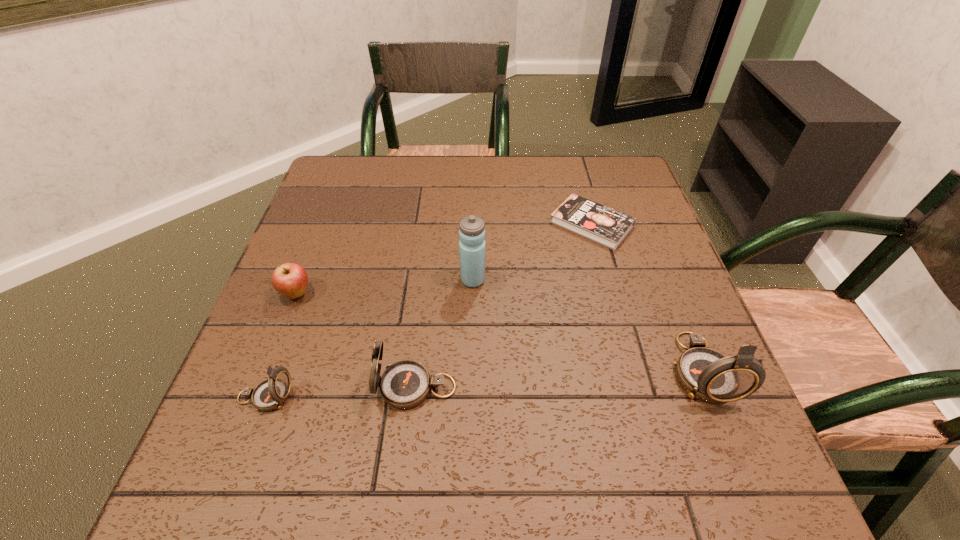
This screenshot has width=960, height=540. I want to click on object situated at the near left corner, so click(270, 394).

The height and width of the screenshot is (540, 960). What are the coordinates of `object at the far right corner` in the screenshot? It's located at (608, 227).

The width and height of the screenshot is (960, 540). I want to click on object situated at the near right corner, so click(706, 374).

In the image, there is a desktop. Where is `vacant space at the far edge`? vacant space at the far edge is located at coordinates (395, 187).

Identify the location of free region at the near edge of the desktop. (632, 414).

The image size is (960, 540). I want to click on free space at the left edge of the desktop, so click(x=261, y=343).

Identify the location of vacant region at the right edge of the desktop. (619, 203).

Image resolution: width=960 pixels, height=540 pixels. In the image, there is a desktop. What are the coordinates of `vacant space at the far left corner` in the screenshot? It's located at (353, 198).

In the image, there is a desktop. Where is `vacant space at the far right corner`? vacant space at the far right corner is located at coordinates (632, 197).

Identify the location of free space at the near right corner of the desktop. [x=684, y=427].